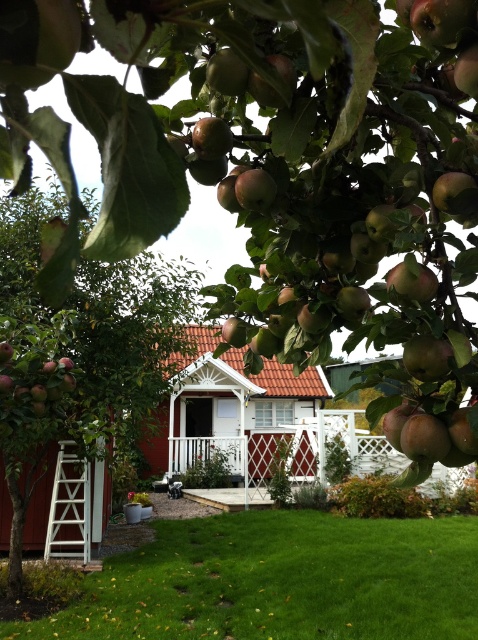
You are standing in the garden and want to pick an apple from the tree. You see the green grass at lower center and the green glossy apples at left. Which direction should you move to reach the apples?

The green glossy apples at left are located to the left of the green grass at lower center. Since you are standing on the green grass at lower center, you should move to your left to reach the apples.